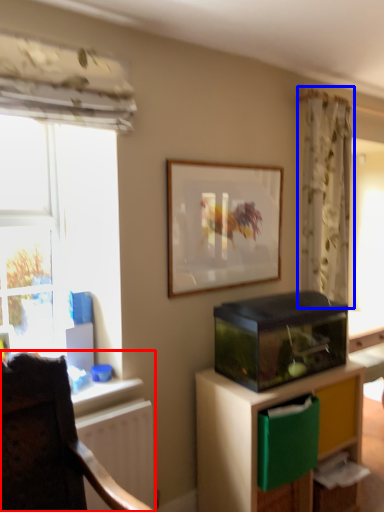
Question: Which object appears closest to the camera in this image, chair (highlighted by a red box) or curtain (highlighted by a blue box)?

Choices:
 (A) chair
 (B) curtain

Answer: (A)